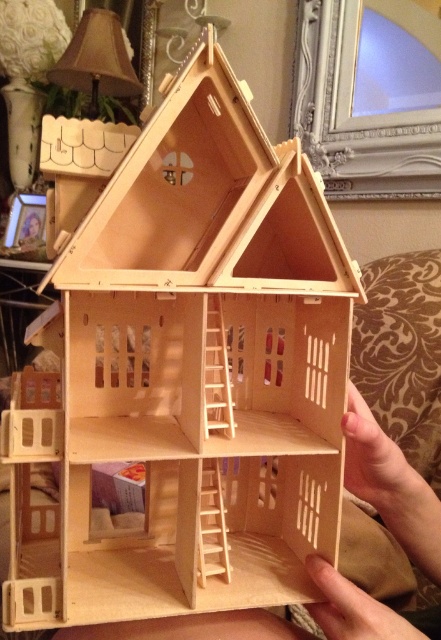
Question: Which point appears closest to the camera in this image?

Choices:
 (A) [85, 54]
 (B) [195, 620]

Answer: (B)

Question: Is natural wood dollhouse at center positioned in front of beige fabric lampshade at upper left?

Choices:
 (A) yes
 (B) no

Answer: (A)

Question: Is natural wood dollhouse at center above beige fabric lampshade at upper left?

Choices:
 (A) no
 (B) yes

Answer: (A)

Question: Among these points, which one is nearest to the camera?

Choices:
 (A) (369, 435)
 (B) (130, 65)

Answer: (A)

Question: Which of the following is the closest to the observer?

Choices:
 (A) (261, 636)
 (B) (74, 86)

Answer: (A)

Question: In this image, where is natural wood dollhouse at center located relative to beige fabric lampshade at upper left?

Choices:
 (A) below
 (B) above

Answer: (A)